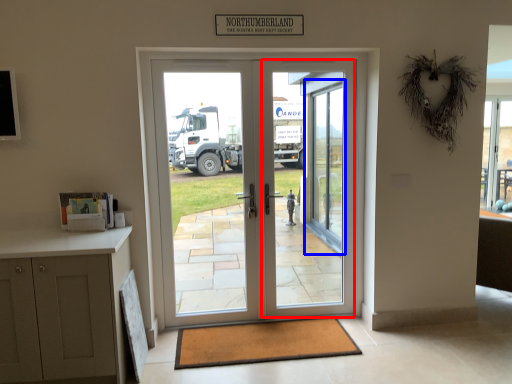
Question: Which object appears farthest to the camera in this image, screen door (highlighted by a red box) or glass door (highlighted by a blue box)?

Choices:
 (A) screen door
 (B) glass door

Answer: (B)